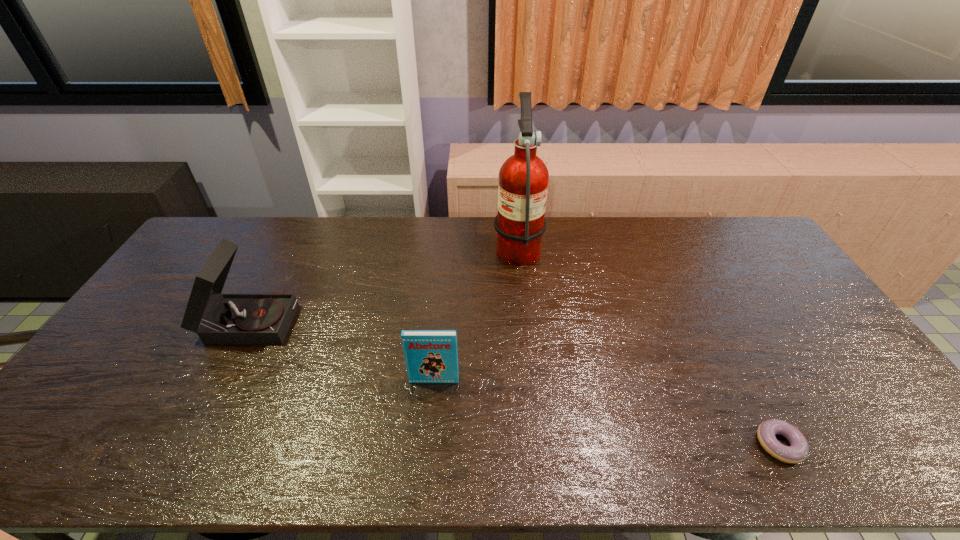
This screenshot has width=960, height=540. In order to click on vacant space located on the nozzle and handle of the farthest object in this screenshot , I will do `click(432, 246)`.

The image size is (960, 540). Identify the location of free location located on the front-facing side of the second farthest object. (337, 319).

Where is `free space located 0.200m on the front cover of the second shortest object`? The image size is (960, 540). free space located 0.200m on the front cover of the second shortest object is located at coordinates (427, 457).

Find the location of a particular element. The height and width of the screenshot is (540, 960). free space located 0.200m on the right of the doughnut is located at coordinates (887, 444).

The height and width of the screenshot is (540, 960). Find the location of `object located in the far edge section of the desktop`. object located in the far edge section of the desktop is located at coordinates (523, 178).

You are a GUI agent. You are given a task and a screenshot of the screen. Output one action in this format:
    pyautogui.click(x=<x>, y=<y>)
    Task: Click on the object that is at the near edge
    The image size is (960, 540).
    Given the screenshot: What is the action you would take?
    coord(798,450)

What are the coordinates of `blank space at the far edge of the desktop` in the screenshot? It's located at (277, 225).

In the image, there is a desktop. At what (x,y) coordinates should I click in order to perform the action: click on blank space at the near edge. Please return your answer as a coordinate pair (x, y). Looking at the image, I should click on (661, 441).

In the image, there is a desktop. What are the coordinates of `vacant space at the left edge` in the screenshot? It's located at (160, 336).

In the image, there is a desktop. What are the coordinates of `free space at the right edge` in the screenshot? It's located at click(x=756, y=290).